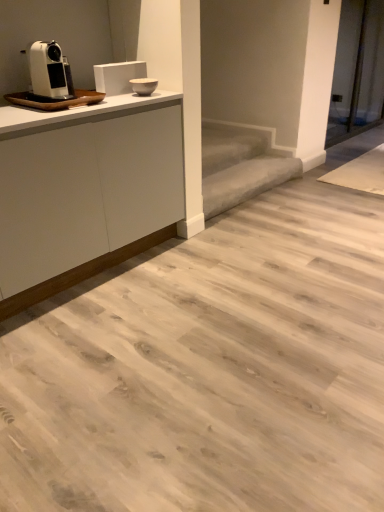
The width and height of the screenshot is (384, 512). What do you see at coordinates (239, 167) in the screenshot?
I see `gray carpeted stair at center` at bounding box center [239, 167].

Where is `white plastic coffee machine at left`? white plastic coffee machine at left is located at coordinates (49, 70).

The image size is (384, 512). I want to click on gray carpeted stair at center, so click(x=239, y=167).

In terms of size, does white plastic coffee machine at left appear bigger or smaller than white matte cabinet at upper left?

white plastic coffee machine at left is smaller than white matte cabinet at upper left.

Is white plastic coffee machine at left facing away from white matte cabinet at upper left?

No, white matte cabinet at upper left is not at the back of white plastic coffee machine at left.

Which object is positioned more to the right, white plastic coffee machine at left or white matte cabinet at upper left?

white matte cabinet at upper left is more to the right.

There is a gray carpeted stair at center. Where is `cabinetry above it (from a real-world perspective)`? cabinetry above it (from a real-world perspective) is located at coordinates (86, 197).

Considering the sizes of objects white matte cabinet at upper left and gray carpeted stair at center in the image provided, who is bigger, white matte cabinet at upper left or gray carpeted stair at center?

With larger size is white matte cabinet at upper left.

Is white matte cabinet at upper left far from gray carpeted stair at center?

No.

Visually, is white matte cabinet at upper left positioned to the left or to the right of gray carpeted stair at center?

From the image, it's evident that white matte cabinet at upper left is to the left of gray carpeted stair at center.

Considering the relative sizes of gray carpeted stair at center and white matte cabinet at upper left in the image provided, is gray carpeted stair at center bigger than white matte cabinet at upper left?

No.

From a real-world perspective, does gray carpeted stair at center sit lower than white matte cabinet at upper left?

Yes, from a real-world perspective, gray carpeted stair at center is below white matte cabinet at upper left.

Considering the sizes of objects gray carpeted stair at center and white matte cabinet at upper left in the image provided, who is thinner, gray carpeted stair at center or white matte cabinet at upper left?

gray carpeted stair at center is thinner.

Looking at this image, is white plastic coffee machine at left facing towards gray carpeted stair at center?

No, white plastic coffee machine at left is not aimed at gray carpeted stair at center.

Looking at this image, which is in front, white plastic coffee machine at left or gray carpeted stair at center?

white plastic coffee machine at left is closer to the camera.

From a real-world perspective, relative to gray carpeted stair at center, is white plastic coffee machine at left vertically above or below?

Clearly, from a real-world perspective, white plastic coffee machine at left is above gray carpeted stair at center.

Locate an element on the screen. Image resolution: width=384 pixels, height=512 pixels. stair that appears behind the white plastic coffee machine at left is located at coordinates (239, 167).

How distant is gray carpeted stair at center from white plastic coffee machine at left?

The distance of gray carpeted stair at center from white plastic coffee machine at left is 1.51 meters.

Is gray carpeted stair at center facing away from white plastic coffee machine at left?

gray carpeted stair at center is not turned away from white plastic coffee machine at left.

Identify the location of home appliance that is on the left side of gray carpeted stair at center. The image size is (384, 512). (49, 70).

Based on the photo, from a real-world perspective, is gray carpeted stair at center physically above white plastic coffee machine at left?

Actually, gray carpeted stair at center is physically below white plastic coffee machine at left in the real world.

Does white matte cabinet at upper left have a greater height compared to white plastic coffee machine at left?

Correct, white matte cabinet at upper left is much taller as white plastic coffee machine at left.

Which is farther, [30,249] or [54,69]?

Point [54,69]

Is white matte cabinet at upper left with white plastic coffee machine at left?

No, white matte cabinet at upper left is not making contact with white plastic coffee machine at left.

Measure the distance between white matte cabinet at upper left and white plastic coffee machine at left.

white matte cabinet at upper left is 20.99 inches away from white plastic coffee machine at left.

The width and height of the screenshot is (384, 512). I want to click on home appliance on the left side of white matte cabinet at upper left, so click(x=49, y=70).

Image resolution: width=384 pixels, height=512 pixels. What are the coordinates of `stair below the white matte cabinet at upper left (from a real-world perspective)` in the screenshot? It's located at (239, 167).

Based on their spatial positions, is white matte cabinet at upper left or gray carpeted stair at center further from white plastic coffee machine at left?

gray carpeted stair at center lies further to white plastic coffee machine at left than the other object.

Estimate the real-world distances between objects in this image. Which object is closer to gray carpeted stair at center, white matte cabinet at upper left or white plastic coffee machine at left?

white matte cabinet at upper left.

Which object lies nearer to the anchor point gray carpeted stair at center, white plastic coffee machine at left or white matte cabinet at upper left?

white matte cabinet at upper left.

When comparing their distances from white plastic coffee machine at left, does gray carpeted stair at center or white matte cabinet at upper left seem closer?

white matte cabinet at upper left is positioned closer to the anchor white plastic coffee machine at left.

Based on their spatial positions, is white plastic coffee machine at left or gray carpeted stair at center further from white matte cabinet at upper left?

The object further to white matte cabinet at upper left is gray carpeted stair at center.

Based on their spatial positions, is gray carpeted stair at center or white plastic coffee machine at left further from white matte cabinet at upper left?

gray carpeted stair at center is positioned further to the anchor white matte cabinet at upper left.

Locate an element on the screen. The width and height of the screenshot is (384, 512). home appliance located between white matte cabinet at upper left and gray carpeted stair at center in the depth direction is located at coordinates (49, 70).